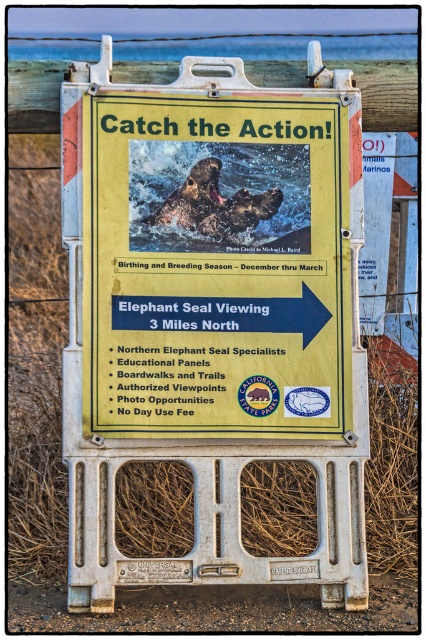
Question: In this image, where is yellow plastic sign at center located relative to grayish-brown elephant seal at center?

Choices:
 (A) below
 (B) above

Answer: (A)

Question: Does yellow plastic sign at center have a smaller size compared to grayish-brown elephant seal at center?

Choices:
 (A) no
 (B) yes

Answer: (A)

Question: Which point is closer to the camera?

Choices:
 (A) grayish-brown elephant seal at center
 (B) yellow plastic sign at center

Answer: (B)

Question: Which object is closer to the camera taking this photo?

Choices:
 (A) yellow plastic sign at center
 (B) grayish-brown elephant seal at center

Answer: (A)

Question: Does yellow plastic sign at center have a greater width compared to grayish-brown elephant seal at center?

Choices:
 (A) yes
 (B) no

Answer: (A)